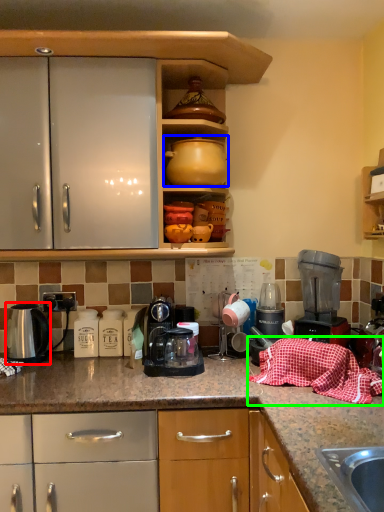
Question: Which object is the closest to the kitchen appliance (highlighted by a red box)? Choose among these: coffeepot (highlighted by a blue box) or blanket (highlighted by a green box).

Choices:
 (A) coffeepot
 (B) blanket

Answer: (A)